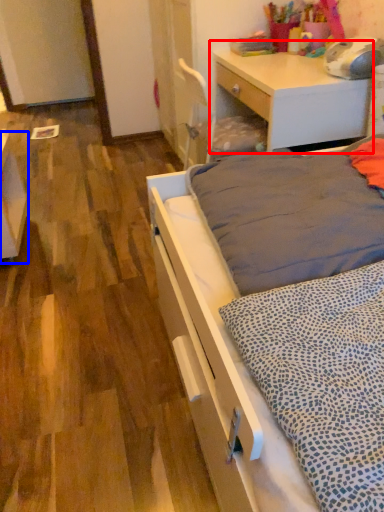
Question: Which object appears farthest to the camera in this image, desk (highlighted by a red box) or vanity (highlighted by a blue box)?

Choices:
 (A) desk
 (B) vanity

Answer: (B)